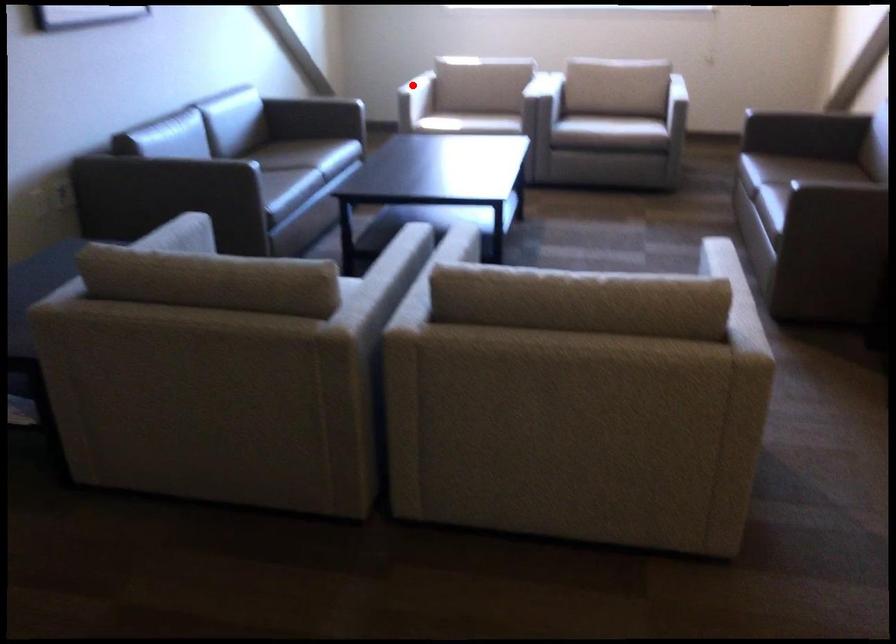
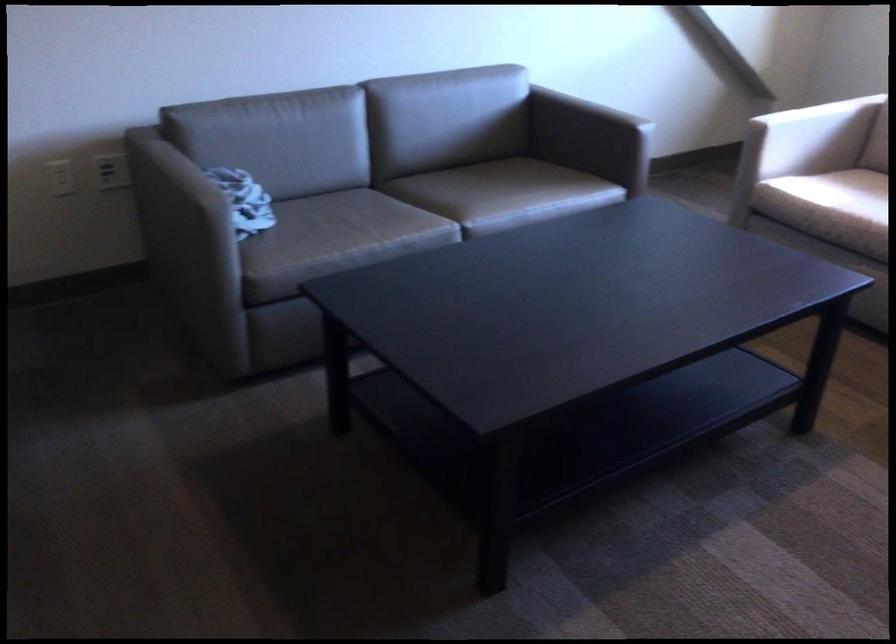
The point at the highlighted location is marked in the first image. Where is the corresponding point in the second image?

(824, 137)